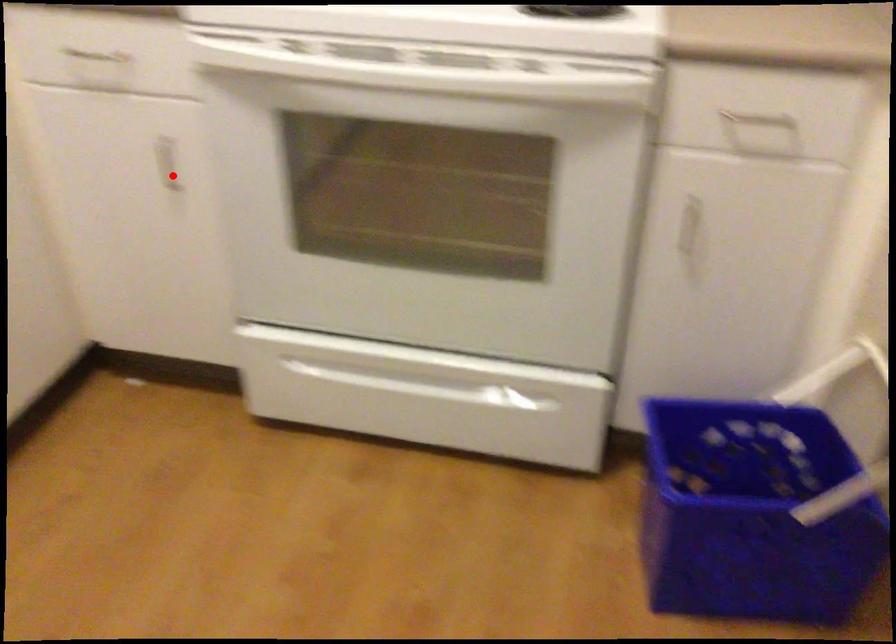
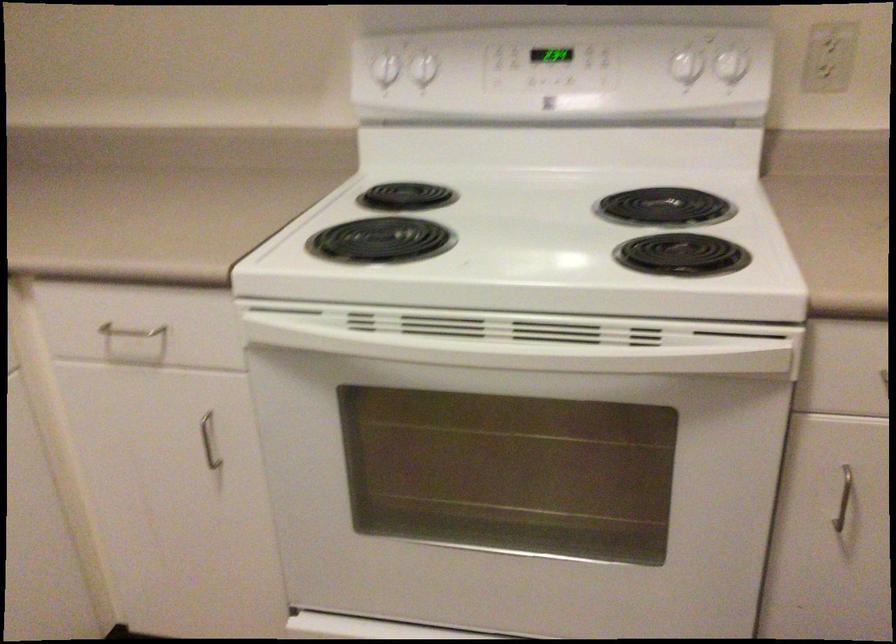
Question: I am providing you with two images of the same scene from different viewpoints. In image1, a red point is highlighted. Considering the same 3D point in image2, which of the following is correct?

Choices:
 (A) It is closer
 (B) It is farther

Answer: (A)